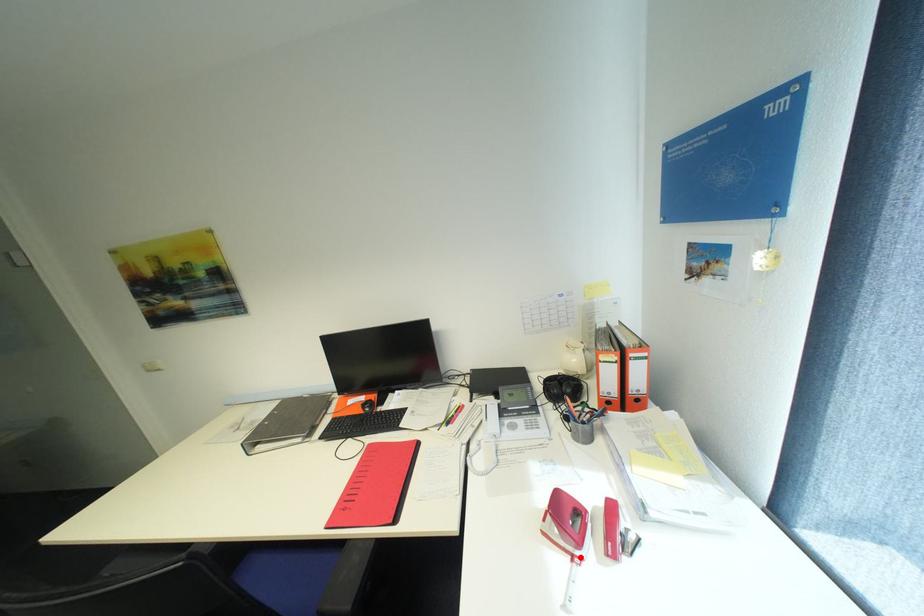
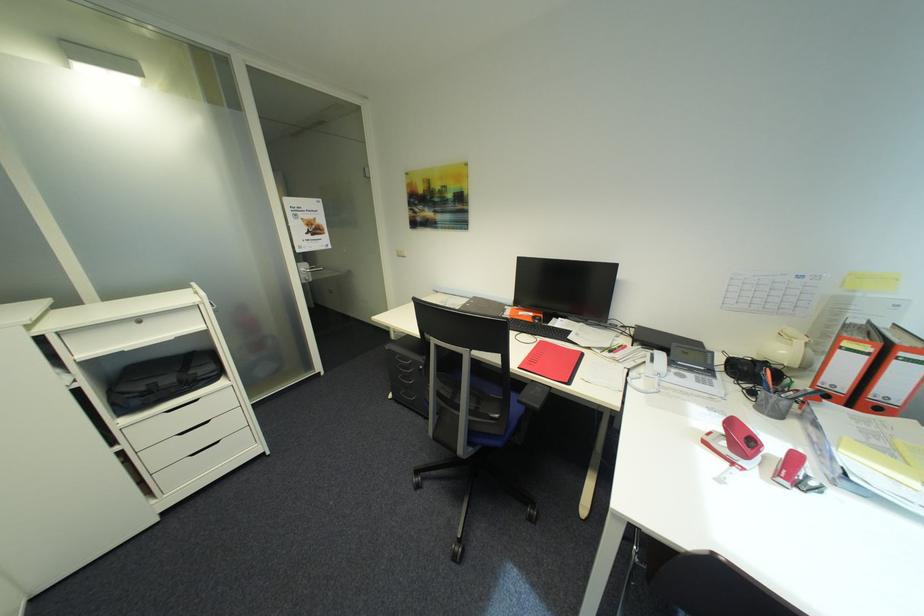
Where in the second image is the point corresponding to the highlighted location from the first image?

(742, 464)